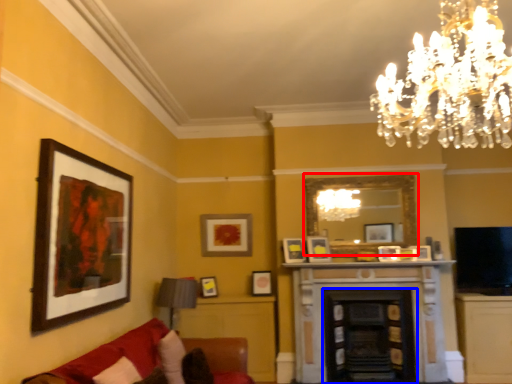
Question: Among these objects, which one is nearest to the camera, mirror (highlighted by a red box) or fireplace (highlighted by a blue box)?

Choices:
 (A) mirror
 (B) fireplace

Answer: (B)